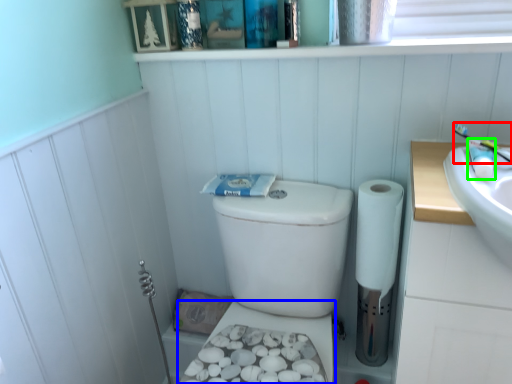
Question: Considering the real-world distances, which object is farthest from toothbrush (highlighted by a red box)? bidet (highlighted by a blue box) or toiletry (highlighted by a green box)?

Choices:
 (A) bidet
 (B) toiletry

Answer: (A)